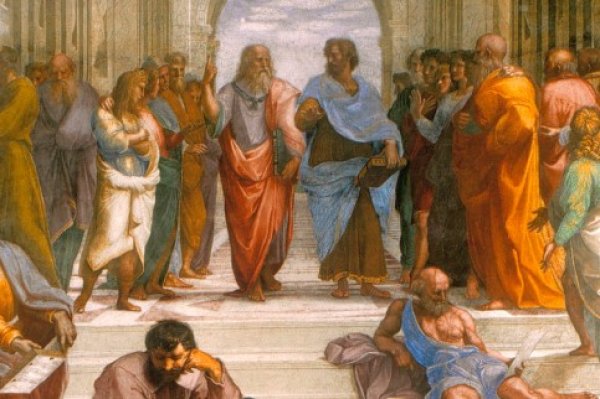
This screenshot has width=600, height=399. Find the location of `painting`. painting is located at coordinates tap(280, 272).